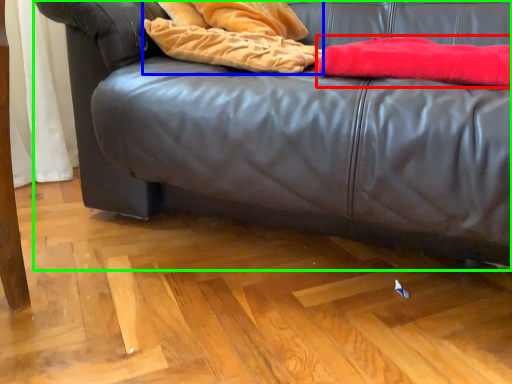
Question: Estimate the real-world distances between objects in this image. Which object is farther from blanket (highlighted by a red box), blanket (highlighted by a blue box) or studio couch (highlighted by a green box)?

Choices:
 (A) blanket
 (B) studio couch

Answer: (B)